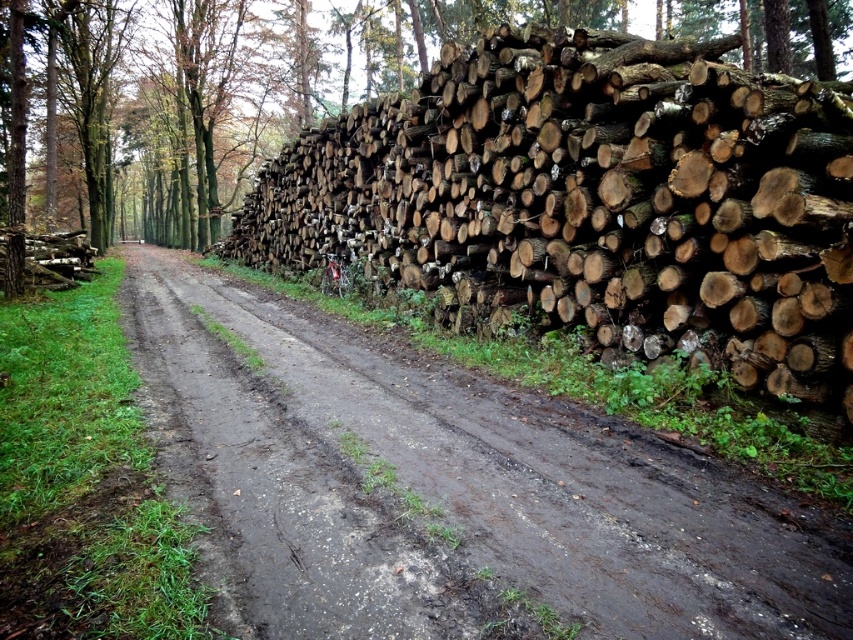
Can you confirm if natural wood logs at right is thinner than dull brown dirt track at center?

Correct, natural wood logs at right's width is less than dull brown dirt track at center's.

Is natural wood logs at right bigger than dull brown dirt track at center?

Incorrect, natural wood logs at right is not larger than dull brown dirt track at center.

Locate an element on the screen. The width and height of the screenshot is (853, 640). natural wood logs at right is located at coordinates (593, 200).

Where is `natural wood logs at right`? The image size is (853, 640). natural wood logs at right is located at coordinates (593, 200).